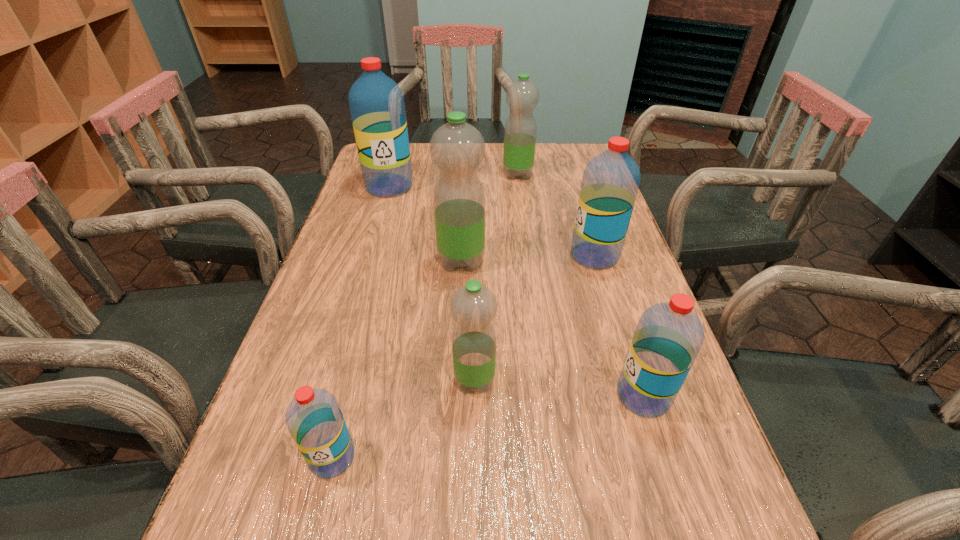
This screenshot has width=960, height=540. Find the location of `vacant space located on the back of the second farthest green water bottle`. vacant space located on the back of the second farthest green water bottle is located at coordinates (465, 195).

Find the location of a particular element. blank space located on the front of the rightmost green water bottle is located at coordinates (522, 209).

Locate an element on the screen. The image size is (960, 540). vacant space located on the front label of the third smallest red water bottle is located at coordinates (501, 255).

I want to click on vacant area located on the front label of the third smallest red water bottle, so pyautogui.click(x=489, y=255).

Image resolution: width=960 pixels, height=540 pixels. What are the coordinates of `free space located on the front label of the third smallest red water bottle` in the screenshot? It's located at (525, 255).

Where is `free spot located on the right of the smallest green water bottle`? free spot located on the right of the smallest green water bottle is located at coordinates (658, 380).

This screenshot has height=540, width=960. I want to click on vacant space located 0.270m on the front label of the second nearest red water bottle, so click(x=466, y=395).

The height and width of the screenshot is (540, 960). In order to click on blank space located 0.330m on the front label of the second nearest red water bottle in this screenshot , I will do `click(433, 395)`.

The height and width of the screenshot is (540, 960). Identify the location of vacant space situated 0.140m on the front label of the second nearest red water bottle. (539, 395).

Identify the location of object that is positioned at the far left corner. The width and height of the screenshot is (960, 540). click(376, 102).